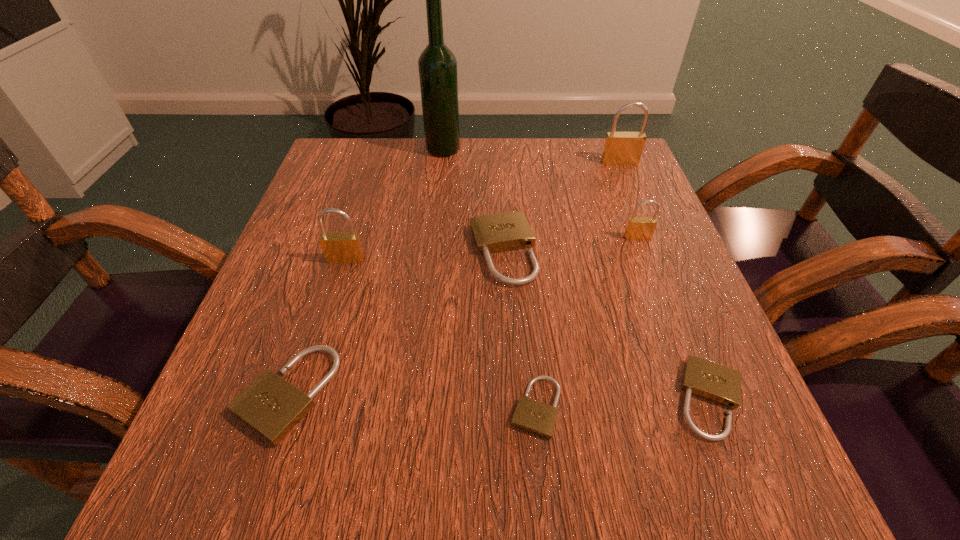
Find the location of `free space at the left edge`. free space at the left edge is located at coordinates (342, 328).

The width and height of the screenshot is (960, 540). Identify the location of vacant space at the right edge. (630, 210).

Find the location of a particular element. The height and width of the screenshot is (540, 960). vacant area at the far left corner is located at coordinates (332, 154).

Image resolution: width=960 pixels, height=540 pixels. In the image, there is a desktop. In order to click on vacant space at the far right corner in this screenshot , I will do `click(635, 173)`.

This screenshot has height=540, width=960. I want to click on unoccupied position between the shortest object and the rightmost beige padlock, so click(623, 403).

Where is `free space between the fourth tallest padlock and the rightmost beige padlock`? The image size is (960, 540). free space between the fourth tallest padlock and the rightmost beige padlock is located at coordinates (607, 326).

Identify the location of vacant area that lies between the tallest object and the second tallest padlock. The height and width of the screenshot is (540, 960). (395, 205).

This screenshot has width=960, height=540. What are the coordinates of `vacant space in between the farthest object and the shortest padlock` in the screenshot? It's located at (490, 279).

Locate an element on the screen. vacant area that lies between the fourth shortest padlock and the shortest padlock is located at coordinates (519, 329).

The image size is (960, 540). Find the location of `free point between the second shortest object and the second biggest beige padlock`. free point between the second shortest object and the second biggest beige padlock is located at coordinates (499, 396).